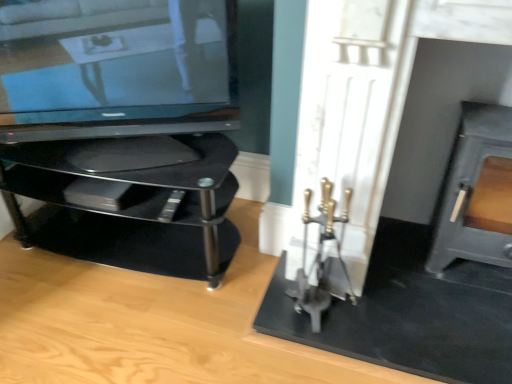
Question: Is black glass tv stand at left directly adjacent to satin black tv at left?

Choices:
 (A) no
 (B) yes

Answer: (A)

Question: Can you confirm if black glass tv stand at left is smaller than satin black tv at left?

Choices:
 (A) yes
 (B) no

Answer: (B)

Question: Is black glass tv stand at left facing towards satin black tv at left?

Choices:
 (A) yes
 (B) no

Answer: (B)

Question: From a real-world perspective, is black glass tv stand at left over satin black tv at left?

Choices:
 (A) no
 (B) yes

Answer: (A)

Question: From a real-world perspective, is black glass tv stand at left located beneath satin black tv at left?

Choices:
 (A) yes
 (B) no

Answer: (A)

Question: In terms of height, does satin black tv at left look taller or shorter compared to black glass tv stand at left?

Choices:
 (A) short
 (B) tall

Answer: (B)

Question: Visually, is satin black tv at left positioned to the left or to the right of black glass tv stand at left?

Choices:
 (A) left
 (B) right

Answer: (B)

Question: Does point (28, 57) appear closer or farther from the camera than point (182, 137)?

Choices:
 (A) closer
 (B) farther

Answer: (A)

Question: From the image's perspective, is satin black tv at left above or below black glass tv stand at left?

Choices:
 (A) below
 (B) above

Answer: (B)

Question: From the image's perspective, is black glass tv stand at left above or below matte gray fireplace at right?

Choices:
 (A) below
 (B) above

Answer: (A)

Question: Is point (193, 244) positioned closer to the camera than point (478, 125)?

Choices:
 (A) closer
 (B) farther

Answer: (B)

Question: Relative to matte gray fireplace at right, is black glass tv stand at left in front or behind?

Choices:
 (A) front
 (B) behind

Answer: (B)

Question: From a real-world perspective, is black glass tv stand at left physically located above or below matte gray fireplace at right?

Choices:
 (A) above
 (B) below

Answer: (B)

Question: Is matte gray fireplace at right wider or thinner than satin black tv at left?

Choices:
 (A) thin
 (B) wide

Answer: (B)

Question: From the image's perspective, is matte gray fireplace at right positioned above or below satin black tv at left?

Choices:
 (A) below
 (B) above

Answer: (A)